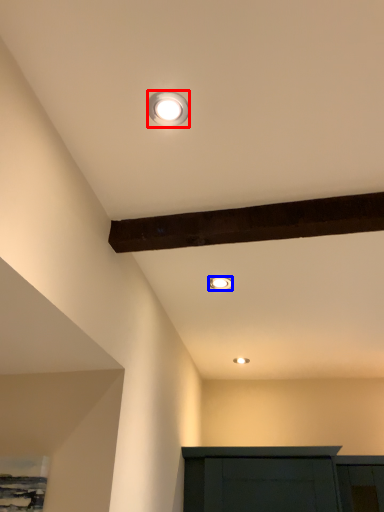
Question: Which object is further to the camera taking this photo, lamp (highlighted by a red box) or lamp (highlighted by a blue box)?

Choices:
 (A) lamp
 (B) lamp

Answer: (B)